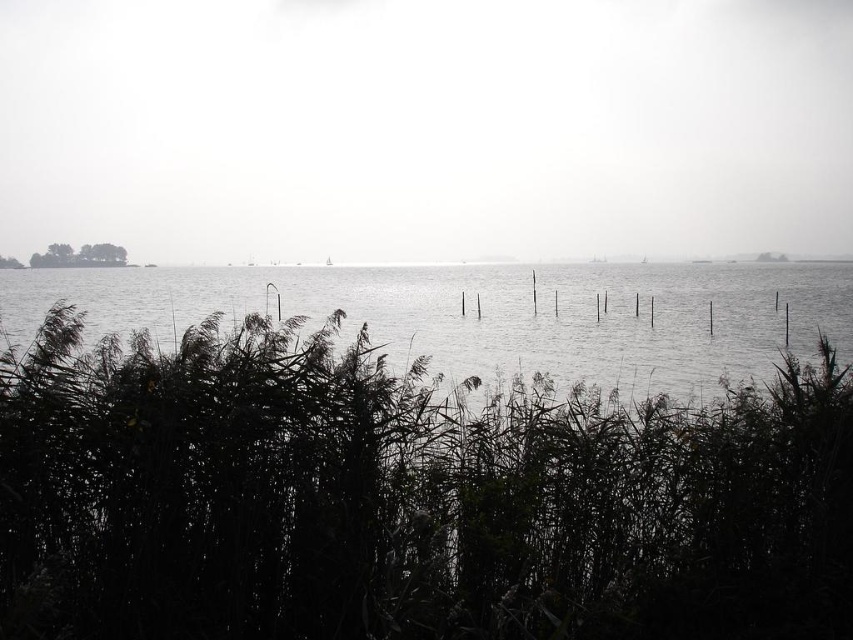
Who is shorter, dark green grass at lower center or clear water at center?

dark green grass at lower center is shorter.

Which of these two, dark green grass at lower center or clear water at center, stands taller?

With more height is clear water at center.

Is point (426, 497) in front of point (285, 268)?

Yes, point (426, 497) is in front of point (285, 268).

The height and width of the screenshot is (640, 853). Find the location of `dark green grass at lower center`. dark green grass at lower center is located at coordinates (405, 499).

Based on the photo, can you confirm if transparent water at center is bigger than clear water at center?

Incorrect, transparent water at center is not larger than clear water at center.

Which is behind, point (25, 216) or point (480, 337)?

The point (25, 216) is more distant.

The height and width of the screenshot is (640, 853). I want to click on transparent water at center, so click(426, 128).

The image size is (853, 640). What do you see at coordinates (405, 499) in the screenshot? I see `dark green grass at lower center` at bounding box center [405, 499].

Who is lower down, dark green grass at lower center or transparent water at center?

Positioned lower is dark green grass at lower center.

I want to click on dark green grass at lower center, so click(x=405, y=499).